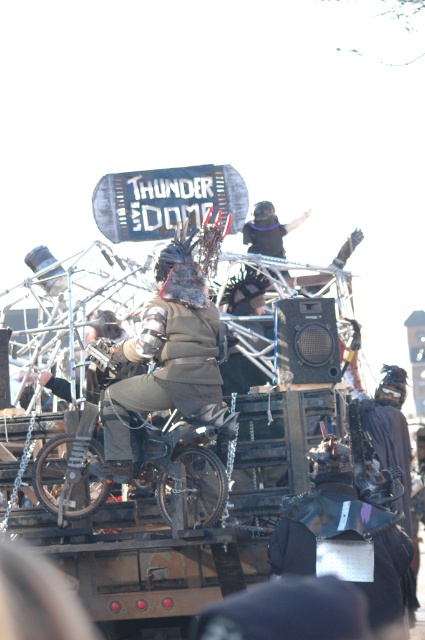
Does dark brown leather jacket at center have a lesser width compared to metallic silver helmet at center?

Yes.

The height and width of the screenshot is (640, 425). What do you see at coordinates (169, 358) in the screenshot?
I see `dark brown leather jacket at center` at bounding box center [169, 358].

Is point (218, 392) positioned after point (359, 536)?

Yes, it is.

At what (x,y) coordinates should I click in order to perform the action: click on dark brown leather jacket at center. Please return your answer as a coordinate pair (x, y). Looking at the image, I should click on (169, 358).

Is point (172, 378) behind point (254, 212)?

No, it is in front of (254, 212).

Is dark brown leather jacket at center closer to the viewer compared to black matte helmet at upper center?

Yes, dark brown leather jacket at center is closer to the viewer.

Between point (181, 262) and point (263, 220), which one is positioned behind?

Point (263, 220)

You are a GUI agent. You are given a task and a screenshot of the screen. Output one action in this format:
    pyautogui.click(x=<x>, y=<y>)
    Task: Click on the dark brown leather jacket at center
    This screenshot has height=640, width=425.
    Given the screenshot: What is the action you would take?
    pyautogui.click(x=169, y=358)

Can you confirm if metallic silver helmet at center is positioned above black matte helmet at upper center?

No.

Does point (397, 616) come farther from viewer compared to point (289, 228)?

No, it is not.

Where is `metallic silver helmet at center`? The width and height of the screenshot is (425, 640). metallic silver helmet at center is located at coordinates (343, 538).